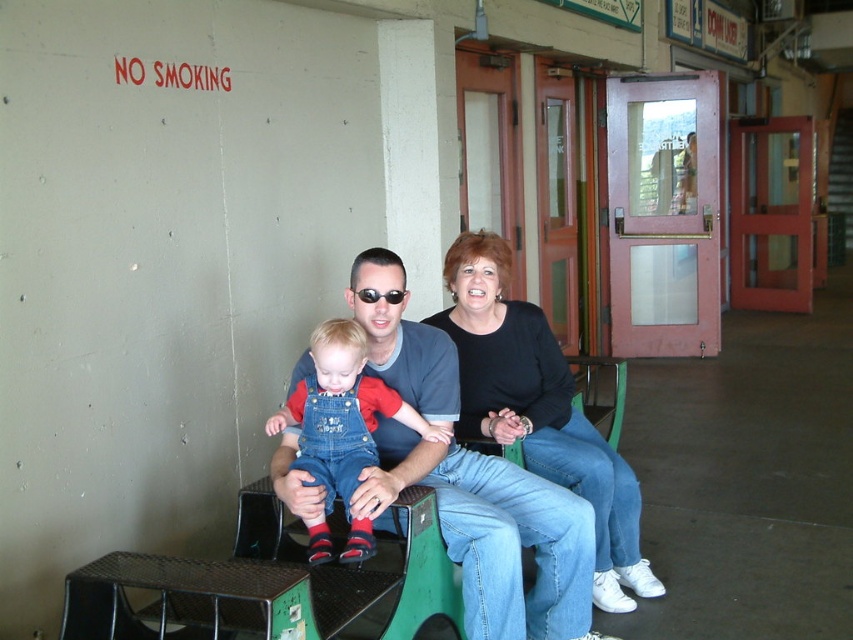
You are a photographer trying to capture a candid shot of the matte blue jeans at center and the denim overalls at center from your current position. Which one will appear larger in your photo?

The matte blue jeans at center will appear larger in the photo because it is closer to the viewer than the denim overalls at center.

You are a security guard in the building. You need to locate the matte blue jeans at center. Where exactly are they located in the scene?

The matte blue jeans at center are located at the coordinates point (492, 534) in the scene.

You are standing in the public building and need to find the black matte shirt at center. According to the scene description, where should you look to locate it?

The black matte shirt at center is located at point (538, 410) in the image coordinates.